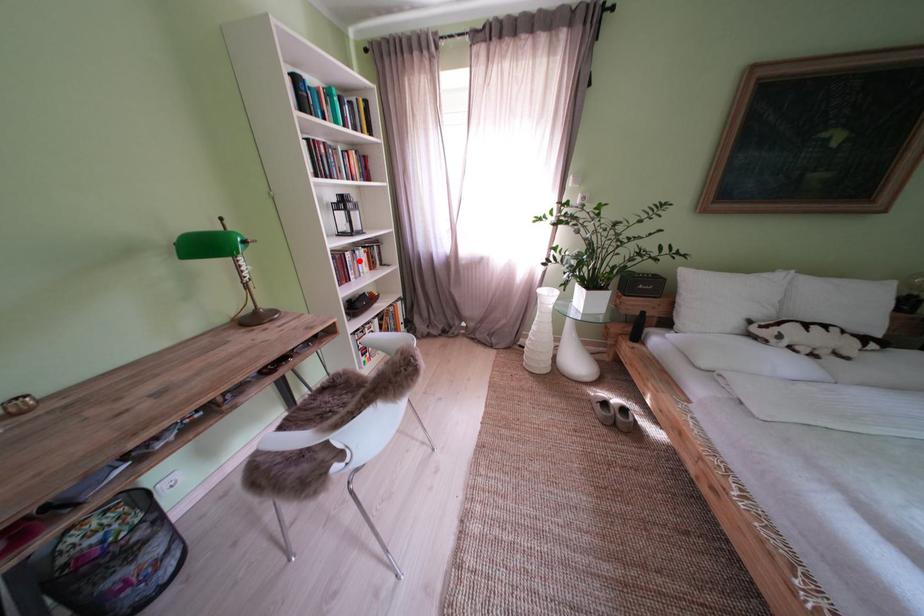
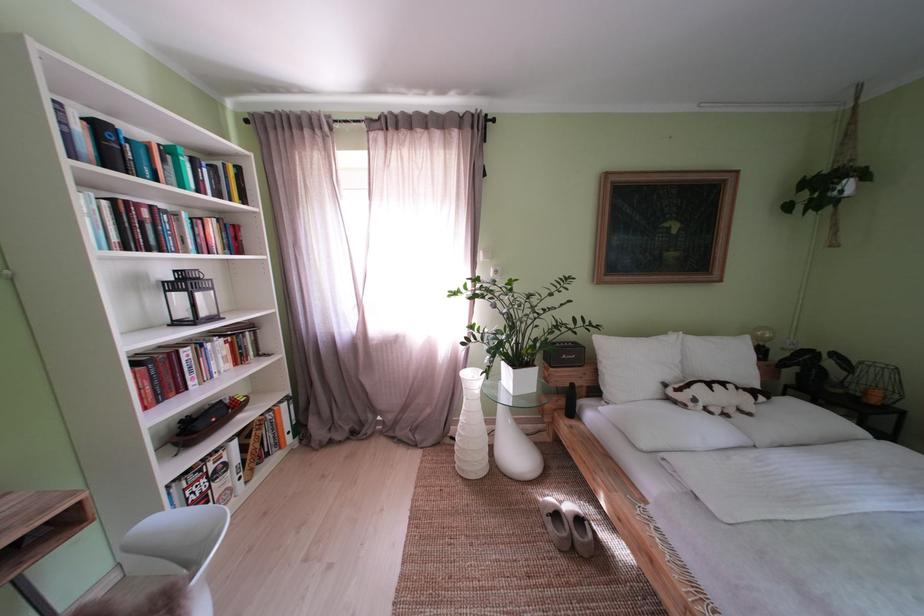
Question: I am providing you with two images of the same scene from different viewpoints. In image1, a red point is highlighted. Considering the same 3D point in image2, which of the following is correct?

Choices:
 (A) It is closer
 (B) It is farther

Answer: (B)